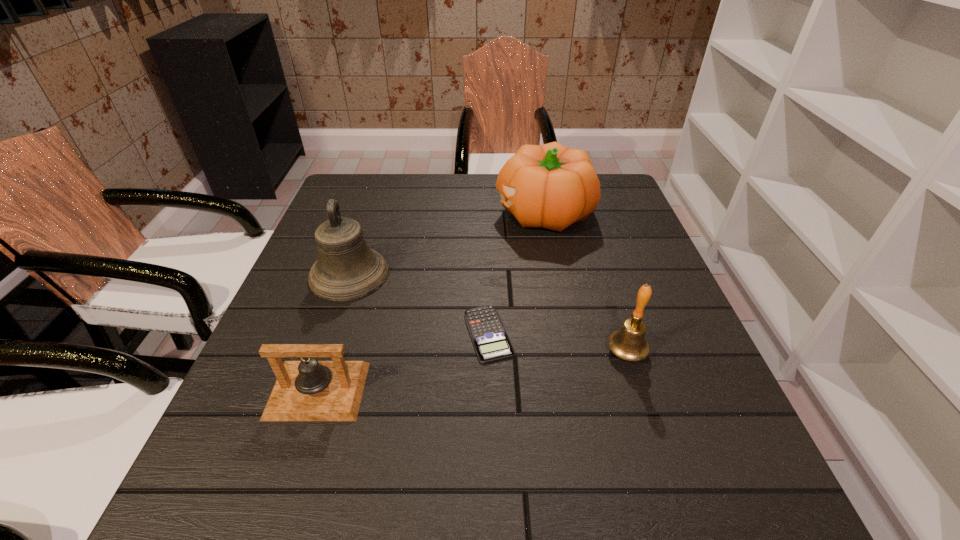
Find the location of a particular element. This screenshot has height=540, width=960. pumpkin is located at coordinates (551, 186).

This screenshot has width=960, height=540. I want to click on the farthest bell, so tap(346, 269).

I want to click on the rightmost bell, so click(x=629, y=343).

Locate an element on the screen. the second shortest object is located at coordinates (309, 390).

Where is `the shortest object`? This screenshot has width=960, height=540. the shortest object is located at coordinates (491, 342).

At what (x,y) coordinates should I click in order to perform the action: click on free space located 0.170m on the carved face of the farthest object. Please return your answer as a coordinate pair (x, y). The image size is (960, 540). Looking at the image, I should click on (433, 213).

The image size is (960, 540). I want to click on free space located 0.290m on the carved face of the farthest object, so click(389, 213).

Identify the location of free region located on the carved face of the farthest object. (348, 213).

I want to click on vacant space located 0.180m on the front of the farthest bell, so click(x=317, y=370).

At what (x,y) coordinates should I click in order to perform the action: click on vacant space situated on the front of the rightmost bell. Please return your answer as a coordinate pair (x, y). This screenshot has width=960, height=540. Looking at the image, I should click on (651, 428).